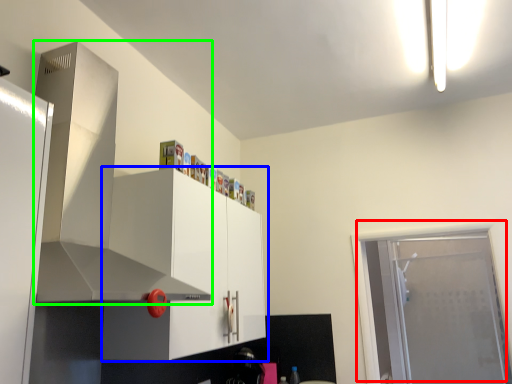
Question: Which object is positioned farthest from door (highlighted by a red box)? Select from cabinetry (highlighted by a blue box) and exhaust hood (highlighted by a green box).

Choices:
 (A) cabinetry
 (B) exhaust hood

Answer: (B)